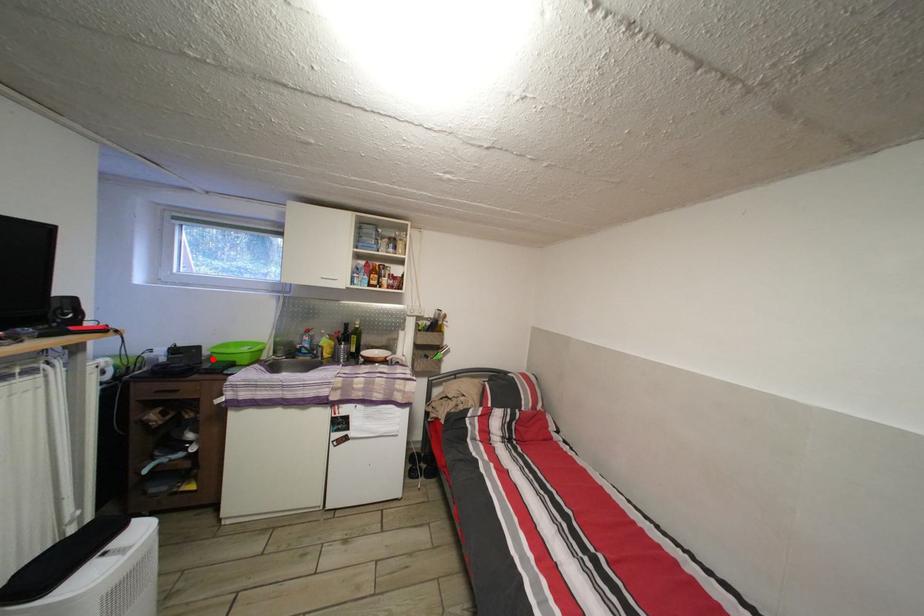
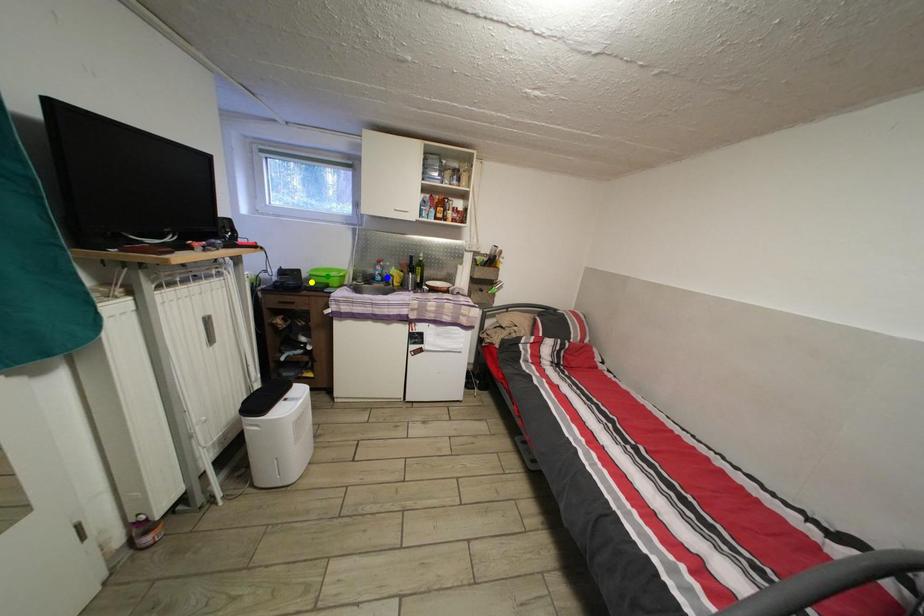
Question: I am providing you with two images of the same scene from different viewpoints. A red point is marked on the first image. You are given multiple points on the second image. Can you choose the point in image 2 that corresponds to the point in image 1?

Choices:
 (A) yellow point
 (B) blue point
 (C) green point

Answer: (A)